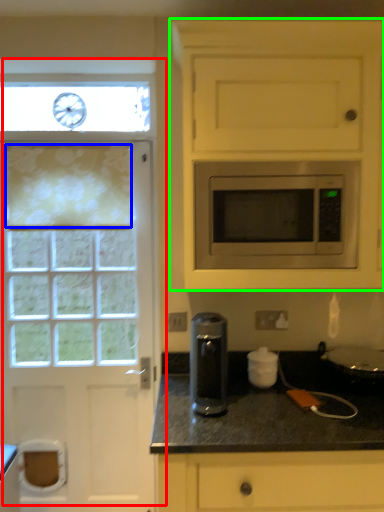
Question: Which object is positioned farthest from door (highlighted by a red box)? Select from curtain (highlighted by a blue box) and cabinetry (highlighted by a green box).

Choices:
 (A) curtain
 (B) cabinetry

Answer: (B)